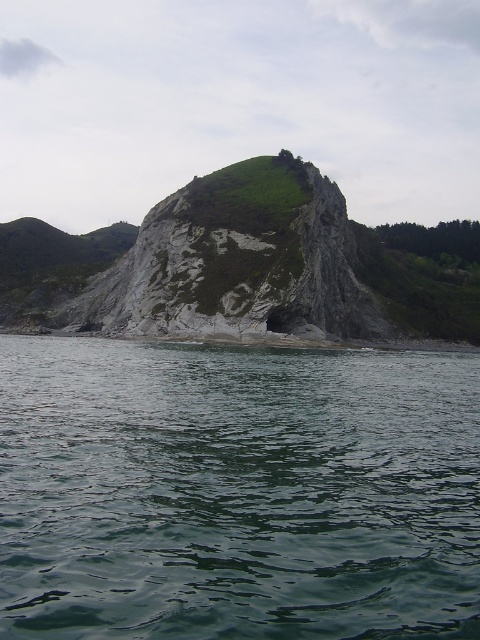
You are standing at the base of the rocky outcrop in the coastal landscape. You notice a point marked at coordinates (237, 492). Based on the scene, what type of surface would you expect to find at that point?

The point at coordinates (237, 492) corresponds to green liquid water at center, so you would expect to find liquid water there.

You are standing on the rough gray rock at center and want to pour a cup of the green liquid water at center onto your head. Is the water accessible from your current position?

The green liquid water at center is below the rough gray rock at center, so you can easily pour the water onto your head from your current position.

You are standing at the edge of the coastal landscape and want to take a photo of both the green liquid water at center and the rough gray rock at center. Which object will appear larger in your photo?

The green liquid water at center will appear larger in the photo because it is closer to the viewer than the rough gray rock at center.